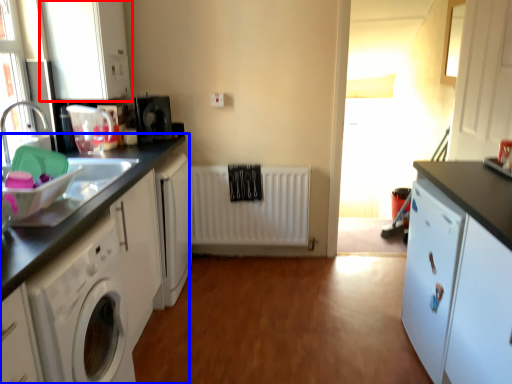
Question: Among these objects, which one is nearest to the camera, cabinetry (highlighted by a red box) or cabinetry (highlighted by a blue box)?

Choices:
 (A) cabinetry
 (B) cabinetry

Answer: (B)